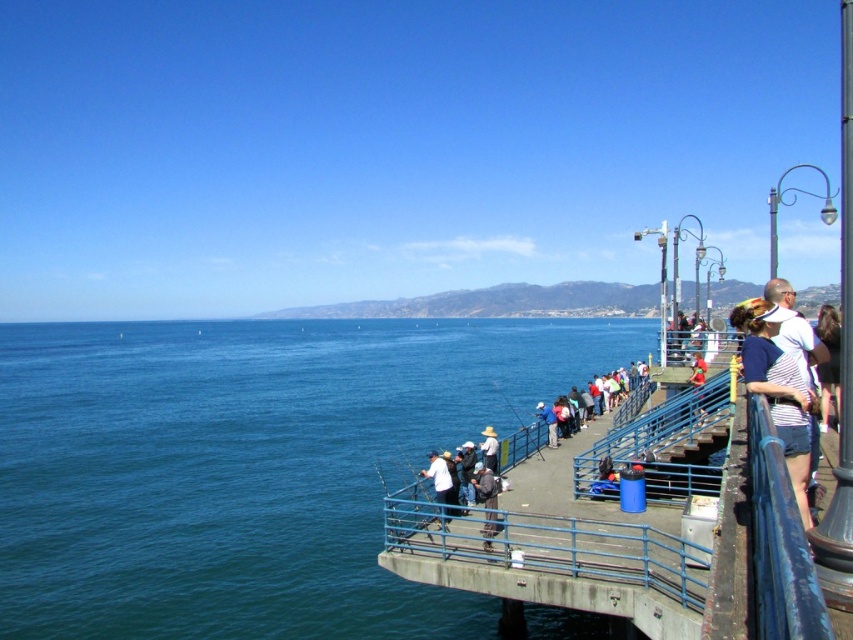
You are standing on the pier and see a person with dark brown hair at right and someone wearing a white cotton hat at center. Which person is positioned higher in the image?

The dark brown hair at right is above the white cotton hat at center, so the person with dark brown hair at right is positioned higher in the image.

You are a photographer standing on the pier and want to take a photo of the blue water at center and the dark brown hair at right. Which object is taller in the image?

The dark brown hair at right is taller than the blue water at center.